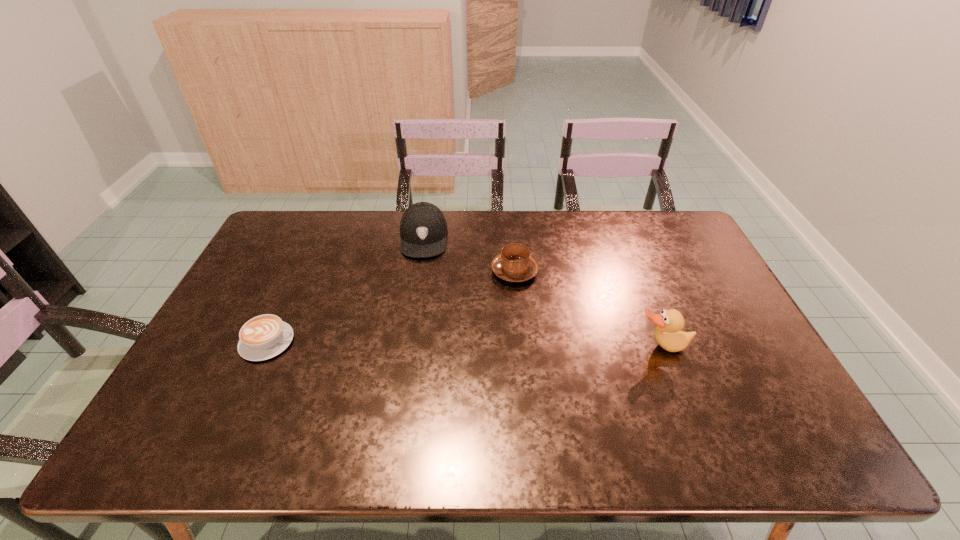
Find the location of a particular element. The width and height of the screenshot is (960, 540). free location at the left edge is located at coordinates (227, 347).

In the image, there is a desktop. Identify the location of vacant space at the right edge. (703, 293).

Locate an element on the screen. This screenshot has width=960, height=540. vacant space at the far left corner of the desktop is located at coordinates (317, 224).

Find the location of a particular element. The width and height of the screenshot is (960, 540). vacant space at the near left corner of the desktop is located at coordinates (196, 384).

Locate an element on the screen. vacant space at the near right corner is located at coordinates (767, 406).

This screenshot has height=540, width=960. In order to click on free spot between the farther cappuccino and the third object from right to left in this screenshot , I will do 469,254.

Locate an element on the screen. vacant area between the nearer cappuccino and the duck is located at coordinates (465, 344).

Find the location of a particular element. This screenshot has height=540, width=960. vacant space in between the second object from left to right and the leftmost object is located at coordinates (346, 289).

Where is `free spot between the duck and the second object from right to left`? The image size is (960, 540). free spot between the duck and the second object from right to left is located at coordinates (588, 309).

The width and height of the screenshot is (960, 540). I want to click on empty space between the tallest object and the farther cappuccino, so click(x=588, y=309).